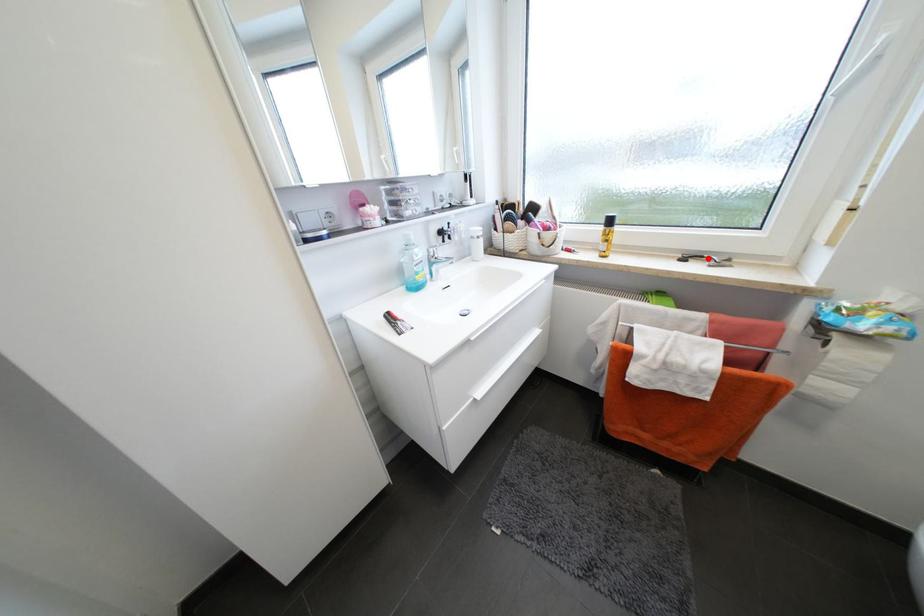
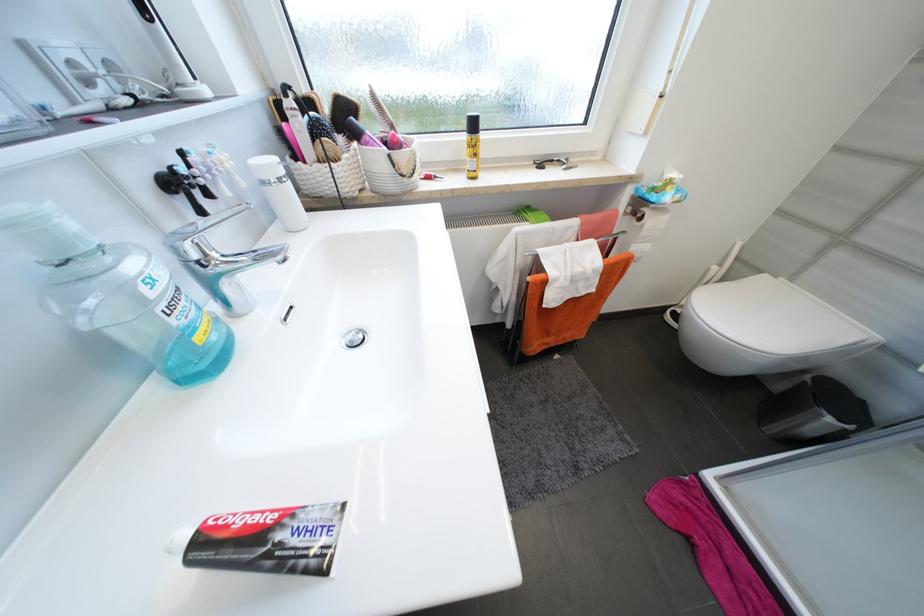
In the second image, find the point that corresponds to the highlighted location in the first image.

(558, 161)